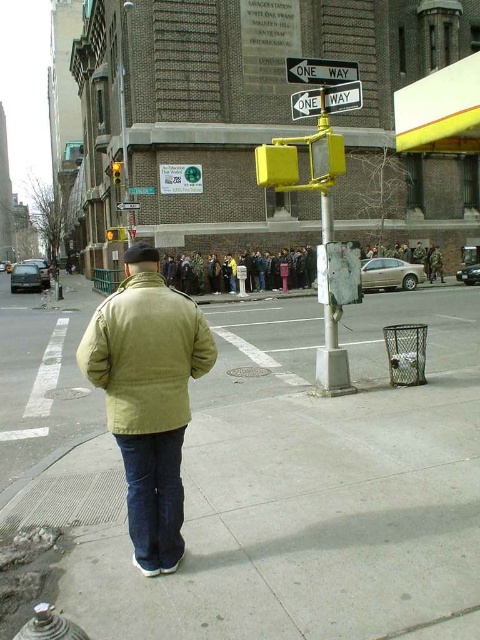
Between point (294, 106) and point (291, 64), which one is positioned in front?

Point (291, 64) is in front.

Which of these two, metallic silver one-way sign at upper center or black plastic one way sign at upper center, stands shorter?

black plastic one way sign at upper center is shorter.

What do you see at coordinates (326, 100) in the screenshot? The width and height of the screenshot is (480, 640). I see `metallic silver one-way sign at upper center` at bounding box center [326, 100].

The width and height of the screenshot is (480, 640). What are the coordinates of `metallic silver one-way sign at upper center` in the screenshot? It's located at (326, 100).

Is point (309, 74) less distant than point (323, 241)?

Yes, point (309, 74) is in front of point (323, 241).

Measure the distance from black plastic one way sign at upper center to yellow plastic pole at center.

black plastic one way sign at upper center is 13.84 feet from yellow plastic pole at center.

Who is more forward, (301,76) or (327,195)?

Point (301,76) is in front.

Locate an element on the screen. This screenshot has height=640, width=480. black plastic one way sign at upper center is located at coordinates (321, 70).

Is smooth concrete sidewalk at center bigger than metallic silver one-way sign at upper center?

Correct, smooth concrete sidewalk at center is larger in size than metallic silver one-way sign at upper center.

Does smooth concrete sidewalk at center have a greater height compared to metallic silver one-way sign at upper center?

No.

The image size is (480, 640). What are the coordinates of `smooth concrete sidewalk at center` in the screenshot? It's located at (271, 477).